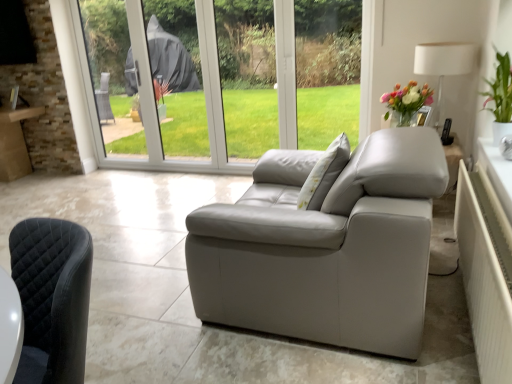
Question: Is green leafy plant at upper right in front of white textured radiator at right?

Choices:
 (A) no
 (B) yes

Answer: (A)

Question: From the image's perspective, is green leafy plant at upper right on top of white textured radiator at right?

Choices:
 (A) no
 (B) yes

Answer: (B)

Question: Does green leafy plant at upper right lie behind white textured radiator at right?

Choices:
 (A) no
 (B) yes

Answer: (B)

Question: Could you tell me if green leafy plant at upper right is facing white textured radiator at right?

Choices:
 (A) yes
 (B) no

Answer: (B)

Question: Can you confirm if green leafy plant at upper right is positioned to the left of white textured radiator at right?

Choices:
 (A) yes
 (B) no

Answer: (B)

Question: Does point (492, 87) appear closer or farther from the camera than point (458, 49)?

Choices:
 (A) closer
 (B) farther

Answer: (A)

Question: Is green leafy plant at upper right to the left or to the right of white fabric lampshade at upper right in the image?

Choices:
 (A) left
 (B) right

Answer: (B)

Question: From the image's perspective, is green leafy plant at upper right located above or below white fabric lampshade at upper right?

Choices:
 (A) below
 (B) above

Answer: (A)

Question: From a real-world perspective, is green leafy plant at upper right above or below white fabric lampshade at upper right?

Choices:
 (A) below
 (B) above

Answer: (B)

Question: Looking at the image, does white fabric lampshade at upper right seem bigger or smaller compared to white textured radiator at right?

Choices:
 (A) big
 (B) small

Answer: (B)

Question: In the image, is white fabric lampshade at upper right positioned in front of or behind white textured radiator at right?

Choices:
 (A) behind
 (B) front

Answer: (A)

Question: From the image's perspective, is white fabric lampshade at upper right located above or below white textured radiator at right?

Choices:
 (A) above
 (B) below

Answer: (A)

Question: From a real-world perspective, is white fabric lampshade at upper right positioned above or below white textured radiator at right?

Choices:
 (A) below
 (B) above

Answer: (B)

Question: Which is correct: white textured radiator at right is inside white fabric lampshade at upper right, or outside of it?

Choices:
 (A) outside
 (B) inside

Answer: (A)

Question: Visually, is white textured radiator at right positioned to the left or to the right of white fabric lampshade at upper right?

Choices:
 (A) right
 (B) left

Answer: (B)